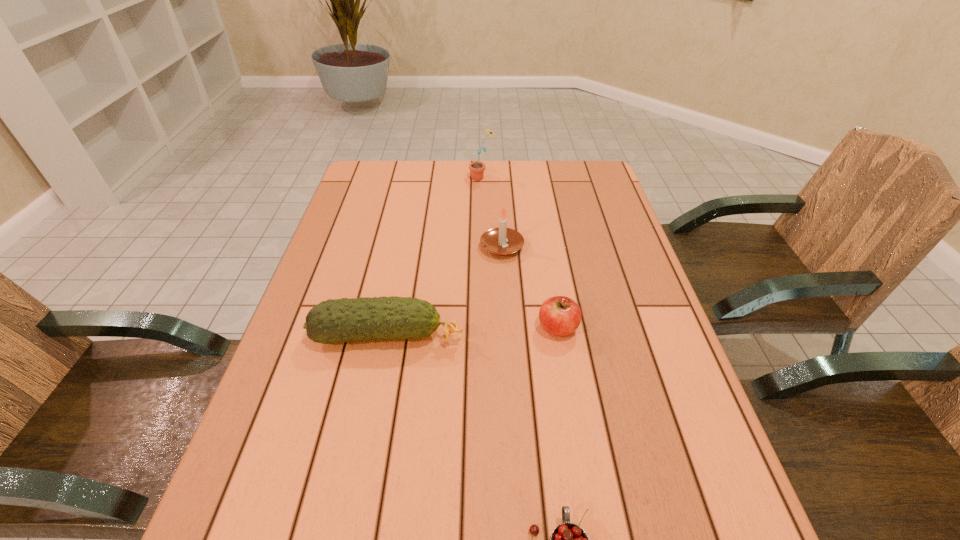
At what (x,y) coordinates should I click in order to perform the action: click on sunflower. Please return your answer as a coordinate pair (x, y). Looking at the image, I should click on (477, 168).

In order to click on the farthest object in this screenshot , I will do `click(477, 168)`.

The width and height of the screenshot is (960, 540). In order to click on candle in this screenshot , I will do `click(502, 241)`.

Identify the location of the second farthest object. The image size is (960, 540). (502, 241).

In order to click on cucumber in this screenshot , I will do `click(332, 321)`.

This screenshot has height=540, width=960. I want to click on apple, so click(x=560, y=316).

Image resolution: width=960 pixels, height=540 pixels. I want to click on vacant space located on the flower of the farthest object, so click(x=410, y=178).

Find the location of a particular element. This screenshot has width=960, height=540. vacant space located 0.230m on the flower of the farthest object is located at coordinates (401, 178).

This screenshot has height=540, width=960. I want to click on vacant area located 0.340m on the flower of the farthest object, so click(x=369, y=178).

Identify the location of vacant space situated 0.230m on the left of the candle. (397, 247).